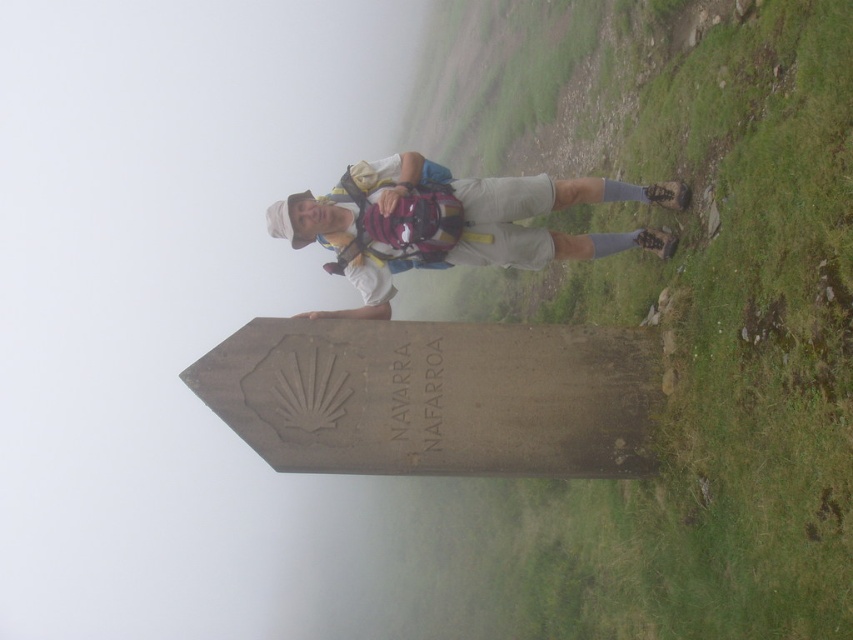
You are a photographer aiming to capture the smooth stone marker at center and the matte white shirt at center in a single shot. Based on their positions, which object will appear larger in the photo?

The smooth stone marker at center will appear larger in the photo because it is closer to the viewer than the matte white shirt at center.

You are a hiker who wants to take a photo of the smooth stone marker at center and the gray stone signpost at center. Since you want both objects to be clearly visible in the frame, which one should you focus on to ensure proper focus given their sizes?

The smooth stone marker at center is bigger than the gray stone signpost at center, so focusing on the larger smooth stone marker at center will ensure both are in focus as it occupies more of the frame.